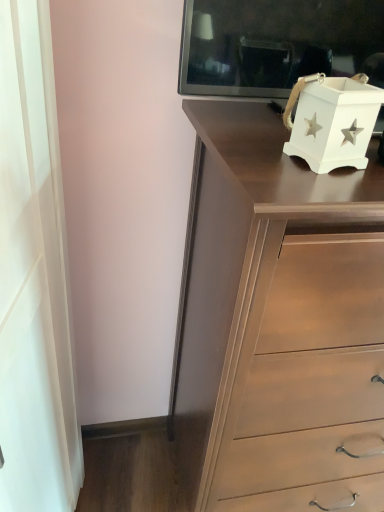
Question: Is white matte curtain at left oriented towards matte brown chest of drawers at center?

Choices:
 (A) no
 (B) yes

Answer: (B)

Question: Is white matte curtain at left thinner than matte brown chest of drawers at center?

Choices:
 (A) no
 (B) yes

Answer: (B)

Question: Is white matte curtain at left closer to camera compared to matte brown chest of drawers at center?

Choices:
 (A) no
 (B) yes

Answer: (A)

Question: Is white matte curtain at left not near matte brown chest of drawers at center?

Choices:
 (A) yes
 (B) no

Answer: (B)

Question: Is white matte curtain at left completely or partially outside of matte brown chest of drawers at center?

Choices:
 (A) no
 (B) yes

Answer: (B)

Question: From the image's perspective, is white matte box at upper right located above or below matte brown chest of drawers at center?

Choices:
 (A) below
 (B) above

Answer: (B)

Question: Is white matte box at upper right to the left or to the right of matte brown chest of drawers at center in the image?

Choices:
 (A) left
 (B) right

Answer: (A)

Question: Is point (337, 103) closer or farther from the camera than point (296, 494)?

Choices:
 (A) farther
 (B) closer

Answer: (B)

Question: In terms of height, does white matte box at upper right look taller or shorter compared to matte brown chest of drawers at center?

Choices:
 (A) short
 (B) tall

Answer: (A)

Question: From the image's perspective, is white matte curtain at left located above or below white matte box at upper right?

Choices:
 (A) below
 (B) above

Answer: (A)

Question: In the image, is white matte curtain at left on the left side or the right side of white matte box at upper right?

Choices:
 (A) right
 (B) left

Answer: (B)

Question: In terms of width, does white matte curtain at left look wider or thinner when compared to white matte box at upper right?

Choices:
 (A) wide
 (B) thin

Answer: (B)

Question: From a real-world perspective, is white matte curtain at left physically located above or below white matte box at upper right?

Choices:
 (A) below
 (B) above

Answer: (A)

Question: From the image's perspective, is white matte box at upper right above or below white matte curtain at left?

Choices:
 (A) below
 (B) above

Answer: (B)

Question: From a real-world perspective, is white matte box at upper right above or below white matte curtain at left?

Choices:
 (A) below
 (B) above

Answer: (B)